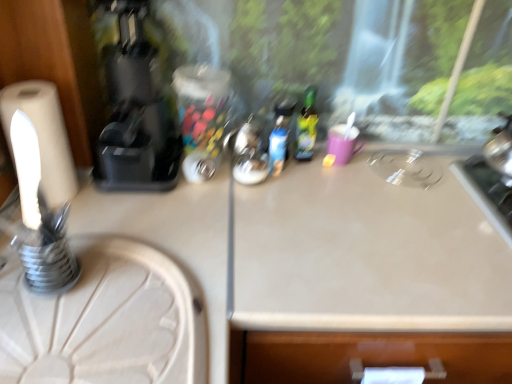
What are the coordinates of `vacant area that is in front of matte plastic bottle at center, which is the 1th bottle from left to right` in the screenshot? It's located at (282, 202).